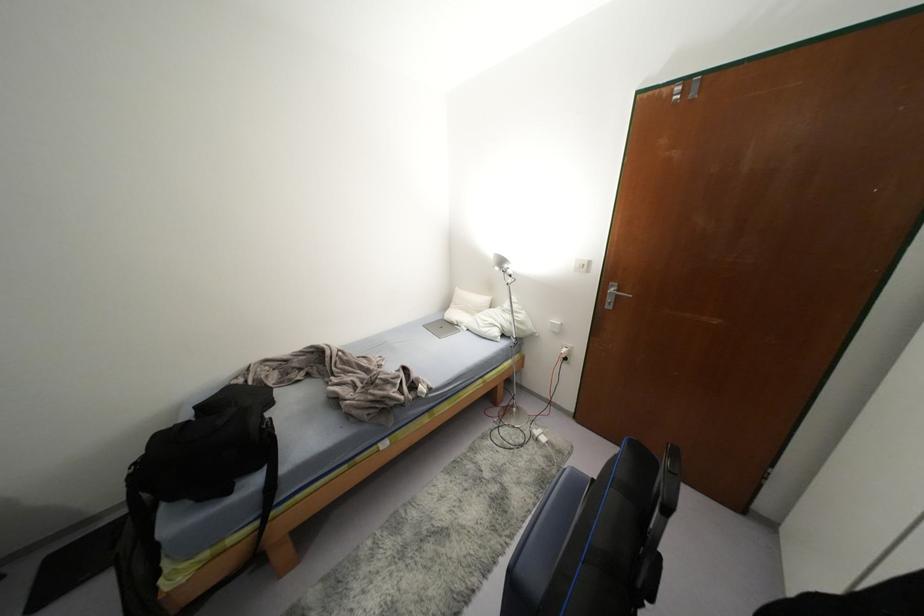
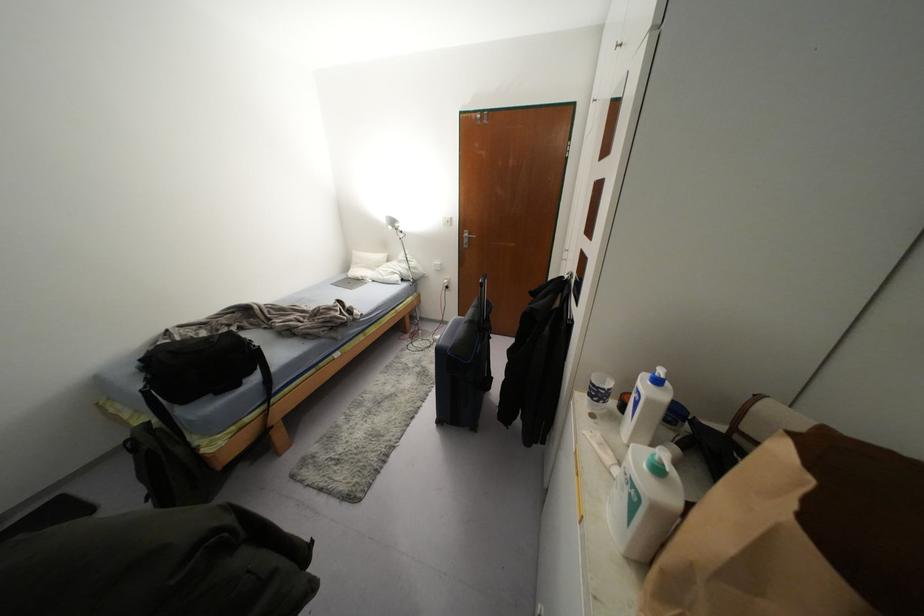
Where in the second image is the point corresponding to pixel 505 265 from the first image?

(395, 225)